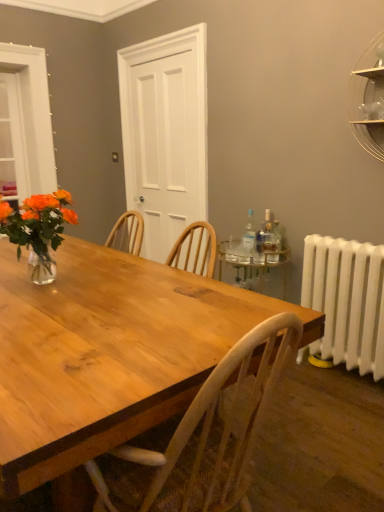
Question: In terms of size, does transparent plastic bottle at right, which is the first bottle in left-to-right order, appear bigger or smaller than wooden table at center?

Choices:
 (A) small
 (B) big

Answer: (A)

Question: From a real-world perspective, is transparent plastic bottle at right, which is the 3th bottle in right-to-left order, physically located above or below wooden table at center?

Choices:
 (A) below
 (B) above

Answer: (B)

Question: Which object is positioned closest to the white painted radiator at right?

Choices:
 (A) clear glass bottle at right, which ranks as the 3th bottle in left-to-right order
 (B) white matte door at center
 (C) translucent glass vase at left
 (D) clear glass shelf at upper right
 (E) translucent glass bottle at right, which is the 2th bottle in left-to-right order

Answer: (E)

Question: Estimate the real-world distances between objects in this image. Which object is closer to the clear glass shelf at upper right?

Choices:
 (A) transparent plastic bottle at right, which is the 3th bottle in right-to-left order
 (B) translucent glass vase at left
 (C) translucent glass bottle at right, which is the 2th bottle in left-to-right order
 (D) clear glass window at upper left
 (E) wooden table at center

Answer: (C)